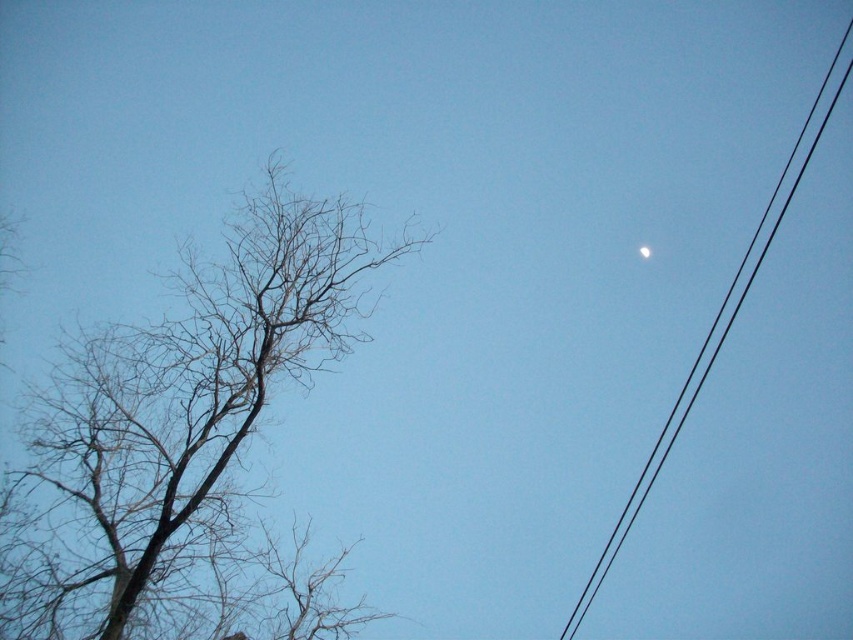
Which is above, black wire at upper right or white glossy moon at upper right?

Positioned higher is black wire at upper right.

Which is below, black wire at upper right or white glossy moon at upper right?

white glossy moon at upper right is below.

Image resolution: width=853 pixels, height=640 pixels. What do you see at coordinates (717, 326) in the screenshot?
I see `black wire at upper right` at bounding box center [717, 326].

Find the location of a particular element. This screenshot has height=640, width=853. black wire at upper right is located at coordinates (717, 326).

Which is in front, point (4, 627) or point (779, 211)?

Point (4, 627)

Can you confirm if brown/dry wood tree at left is positioned above black wire at upper right?

Incorrect, brown/dry wood tree at left is not positioned above black wire at upper right.

Who is more forward, (289,248) or (698,356)?

Positioned in front is point (289,248).

You are a GUI agent. You are given a task and a screenshot of the screen. Output one action in this format:
    pyautogui.click(x=<x>, y=<y>)
    Task: Click on the brown/dry wood tree at left
    This screenshot has width=853, height=640.
    Given the screenshot: What is the action you would take?
    pyautogui.click(x=184, y=435)

Can you confirm if brown/dry wood tree at left is smaller than white glossy moon at upper right?

No, brown/dry wood tree at left is not smaller than white glossy moon at upper right.

How distant is brown/dry wood tree at left from white glossy moon at upper right?

brown/dry wood tree at left is 6.61 meters away from white glossy moon at upper right.

Describe the element at coordinates (184, 435) in the screenshot. I see `brown/dry wood tree at left` at that location.

Where is `brown/dry wood tree at left`? The image size is (853, 640). brown/dry wood tree at left is located at coordinates (184, 435).